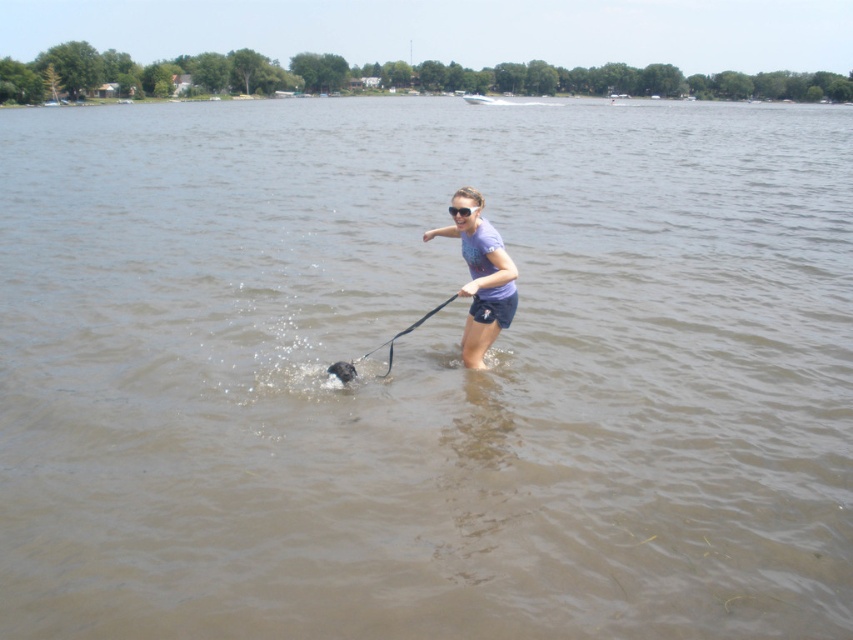
The image size is (853, 640). Describe the element at coordinates (403, 333) in the screenshot. I see `black rubber paddle at center` at that location.

Can you confirm if black rubber paddle at center is smaller than transparent plastic goggles at center?

No.

The image size is (853, 640). Find the location of `black rubber paddle at center`. black rubber paddle at center is located at coordinates (403, 333).

How much distance is there between purple cotton t-shirt at center and transparent plastic goggles at center?

purple cotton t-shirt at center and transparent plastic goggles at center are 24.07 inches apart.

Can you confirm if purple cotton t-shirt at center is positioned above transparent plastic goggles at center?

Actually, purple cotton t-shirt at center is below transparent plastic goggles at center.

Does point (483, 230) lie behind point (461, 212)?

No, it is not.

The width and height of the screenshot is (853, 640). What are the coordinates of `purple cotton t-shirt at center` in the screenshot? It's located at (480, 282).

Can you confirm if purple cotton t-shirt at center is thinner than shiny black dog at center?

No.

Between purple cotton t-shirt at center and shiny black dog at center, which one is positioned higher?

purple cotton t-shirt at center is higher up.

This screenshot has width=853, height=640. What do you see at coordinates (480, 282) in the screenshot? I see `purple cotton t-shirt at center` at bounding box center [480, 282].

Where is `purple cotton t-shirt at center`? This screenshot has height=640, width=853. purple cotton t-shirt at center is located at coordinates (480, 282).